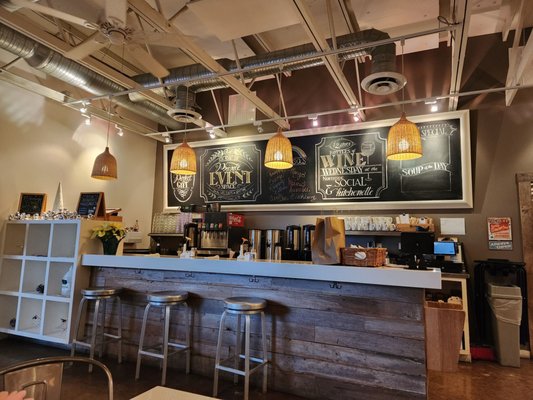
You are a GUI agent. You are given a task and a screenshot of the screen. Output one action in this format:
    pyautogui.click(x=<x>, y=<y>)
    Task: Click on the northside kitchenette
    Image resolution: width=533 pixels, height=400 pixels.
    Given the screenshot: What is the action you would take?
    pyautogui.click(x=240, y=223)